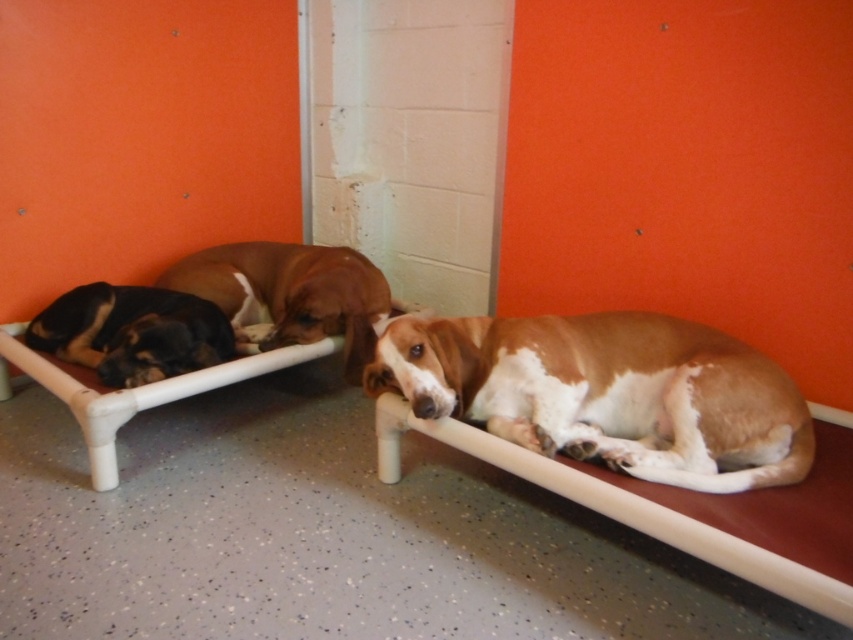
Can you confirm if brown/white fur dog at center is positioned above brown fur at center?

No, brown/white fur dog at center is not above brown fur at center.

Is point (537, 321) in front of point (271, 316)?

Yes, point (537, 321) is in front of point (271, 316).

You are a GUI agent. You are given a task and a screenshot of the screen. Output one action in this format:
    pyautogui.click(x=<x>, y=<y>)
    Task: Click on the brown/white fur dog at center
    
    Given the screenshot: What is the action you would take?
    pyautogui.click(x=607, y=392)

Is brown/white fur dog at center smaller than black and tan fur at left?

Actually, brown/white fur dog at center might be larger than black and tan fur at left.

Where is `brown/white fur dog at center`? The image size is (853, 640). brown/white fur dog at center is located at coordinates (607, 392).

Does brown fur at center have a smaller size compared to black and tan fur at left?

No, brown fur at center is not smaller than black and tan fur at left.

Can you confirm if brown fur at center is thinner than black and tan fur at left?

No, brown fur at center is not thinner than black and tan fur at left.

The image size is (853, 640). Describe the element at coordinates (289, 294) in the screenshot. I see `brown fur at center` at that location.

Image resolution: width=853 pixels, height=640 pixels. Identify the location of brown fur at center. (289, 294).